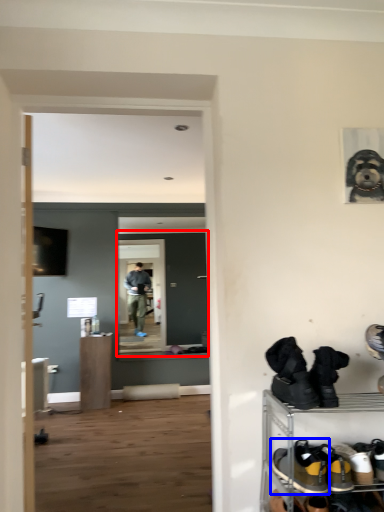
Question: Which object appears farthest to the camera in this image, glass door (highlighted by a red box) or footwear (highlighted by a blue box)?

Choices:
 (A) glass door
 (B) footwear

Answer: (A)